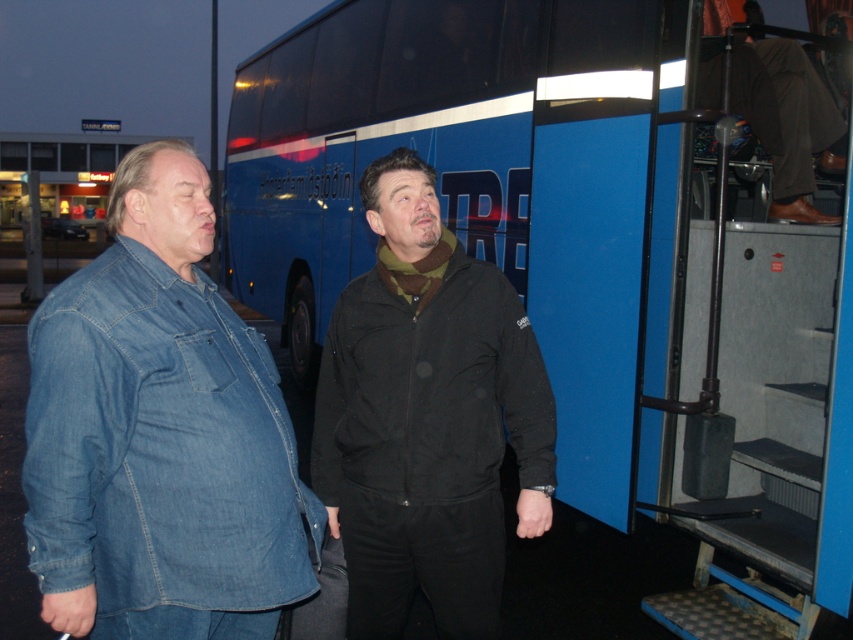
You are a delivery person carrying a box that is 3 meters long. You need to place it on the ground in front of the blue matte bus at center. Is there enough space between you and the bus to place the box without it touching the bus?

The blue matte bus at center is 3.56 meters from the camera. Since the box is 3 meters long, there is sufficient space to place it between you and the bus without touching the bus.

You are a photographer trying to capture both the denim jacket at left and the brown leather jacket at upper right in a single frame. Which jacket should you position closer to the center of your camera viewfinder to ensure both are fully visible?

To ensure both the denim jacket at left and the brown leather jacket at upper right are fully visible in the frame, position the denim jacket at left closer to the center of the camera viewfinder since it is already to the left of the brown leather jacket at upper right, creating a balanced composition.